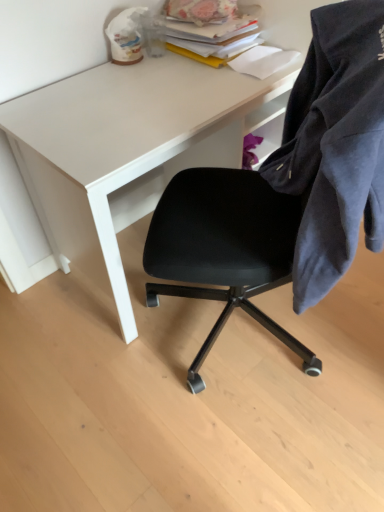
At what (x,y) coordinates should I click in order to perform the action: click on stacked paper at upper right. Please return your answer as a coordinate pair (x, y). This screenshot has width=384, height=512. Looking at the image, I should click on (206, 37).

This screenshot has width=384, height=512. Describe the element at coordinates (335, 145) in the screenshot. I see `dark blue cotton jacket at right` at that location.

Identify the location of stacked paper at upper right. The height and width of the screenshot is (512, 384). (206, 37).

Is dark blue cotton jacket at right shorter than white matte desk at upper center?

Indeed, dark blue cotton jacket at right has a lesser height compared to white matte desk at upper center.

Which object is positioned more to the left, dark blue cotton jacket at right or white matte desk at upper center?

Positioned to the left is white matte desk at upper center.

From the picture: Is dark blue cotton jacket at right surrounding white matte desk at upper center?

Definitely not — white matte desk at upper center is not inside dark blue cotton jacket at right.

Does dark blue cotton jacket at right turn towards white matte desk at upper center?

Yes, dark blue cotton jacket at right is facing white matte desk at upper center.

Which of these two, stacked paper at upper right or white matte desk at upper center, is thinner?

stacked paper at upper right is thinner.

Considering the positions of objects stacked paper at upper right and white matte desk at upper center in the image provided, who is behind, stacked paper at upper right or white matte desk at upper center?

stacked paper at upper right is further from the camera.

Is stacked paper at upper right bigger or smaller than white matte desk at upper center?

Considering their sizes, stacked paper at upper right takes up less space than white matte desk at upper center.

Considering the positions of objects stacked paper at upper right and white matte desk at upper center in the image provided, who is more to the right, stacked paper at upper right or white matte desk at upper center?

stacked paper at upper right is more to the right.

Which object is further away from the camera taking this photo, dark blue cotton jacket at right or stacked paper at upper right?

Positioned behind is stacked paper at upper right.

Considering the sizes of objects dark blue cotton jacket at right and stacked paper at upper right in the image provided, who is thinner, dark blue cotton jacket at right or stacked paper at upper right?

Thinner between the two is dark blue cotton jacket at right.

Could you tell me if dark blue cotton jacket at right is turned towards stacked paper at upper right?

No, dark blue cotton jacket at right is not oriented towards stacked paper at upper right.

Does dark blue cotton jacket at right have a greater height compared to stacked paper at upper right?

Yes, dark blue cotton jacket at right is taller than stacked paper at upper right.

Can you confirm if stacked paper at upper right is positioned to the right of dark blue cotton jacket at right?

In fact, stacked paper at upper right is to the left of dark blue cotton jacket at right.

Does stacked paper at upper right touch dark blue cotton jacket at right?

There is a gap between stacked paper at upper right and dark blue cotton jacket at right.

From the image's perspective, is stacked paper at upper right under dark blue cotton jacket at right?

No, from the image's perspective, stacked paper at upper right is not below dark blue cotton jacket at right.

Is stacked paper at upper right oriented away from dark blue cotton jacket at right?

No, dark blue cotton jacket at right is not at the back of stacked paper at upper right.

Which is closer, (x=219, y=77) or (x=308, y=205)?

Point (x=219, y=77) is farther from the camera than point (x=308, y=205).

This screenshot has height=512, width=384. Identify the location of desk that appears behind the dark blue cotton jacket at right. (149, 126).

From the image's perspective, is white matte desk at upper center above or below dark blue cotton jacket at right?

From the image's perspective, white matte desk at upper center appears above dark blue cotton jacket at right.

Is white matte desk at upper center to the right of dark blue cotton jacket at right from the viewer's perspective?

No.

Is white matte desk at upper center directly adjacent to stacked paper at upper right?

No, white matte desk at upper center is not next to stacked paper at upper right.

Consider the image. Is white matte desk at upper center bigger than stacked paper at upper right?

Indeed, white matte desk at upper center has a larger size compared to stacked paper at upper right.

From the picture: Could you tell me if white matte desk at upper center is facing stacked paper at upper right?

No, white matte desk at upper center is not turned towards stacked paper at upper right.

From the image's perspective, who appears lower, white matte desk at upper center or stacked paper at upper right?

white matte desk at upper center appears lower in the image.

The height and width of the screenshot is (512, 384). I want to click on cloth that is below the white matte desk at upper center (from the image's perspective), so click(335, 145).

In the image, there is a white matte desk at upper center. Where is `book above it (from the image's perspective)`? Image resolution: width=384 pixels, height=512 pixels. book above it (from the image's perspective) is located at coordinates (206, 37).

Based on their spatial positions, is stacked paper at upper right or dark blue cotton jacket at right closer to white matte desk at upper center?

stacked paper at upper right is closer to white matte desk at upper center.

Looking at the image, which one is located closer to dark blue cotton jacket at right, stacked paper at upper right or white matte desk at upper center?

white matte desk at upper center is closer to dark blue cotton jacket at right.

From the image, which object appears to be farther from white matte desk at upper center, dark blue cotton jacket at right or stacked paper at upper right?

dark blue cotton jacket at right lies further to white matte desk at upper center than the other object.

When comparing their distances from stacked paper at upper right, does dark blue cotton jacket at right or white matte desk at upper center seem closer?

white matte desk at upper center.

From the image, which object appears to be farther from stacked paper at upper right, white matte desk at upper center or dark blue cotton jacket at right?

dark blue cotton jacket at right is positioned further to the anchor stacked paper at upper right.

Consider the image. Which object lies nearer to the anchor point dark blue cotton jacket at right, white matte desk at upper center or stacked paper at upper right?

white matte desk at upper center lies closer to dark blue cotton jacket at right than the other object.

Where is `desk between dark blue cotton jacket at right and stacked paper at upper right from front to back`? The width and height of the screenshot is (384, 512). desk between dark blue cotton jacket at right and stacked paper at upper right from front to back is located at coordinates (149, 126).